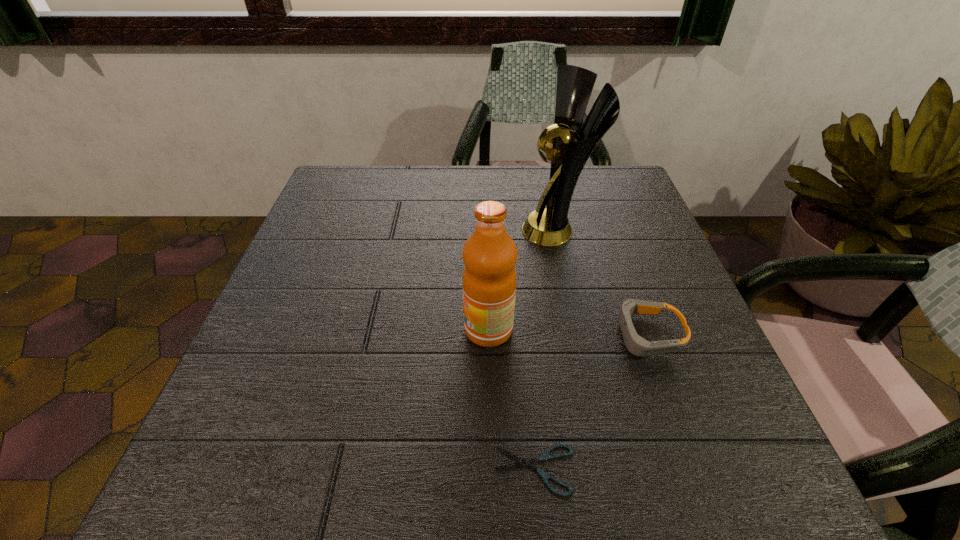
You are a GUI agent. You are given a task and a screenshot of the screen. Output one action in this format:
    pyautogui.click(x=<x>, y=<y>)
    Task: Click on the tallest object
    The image size is (960, 540).
    Given the screenshot: What is the action you would take?
    pyautogui.click(x=550, y=226)

This screenshot has height=540, width=960. In order to click on award in this screenshot , I will do `click(550, 226)`.

The image size is (960, 540). Identify the location of the second tallest object. (489, 280).

What are the coordinates of `goggles` in the screenshot? It's located at (638, 346).

Find the location of `the nearest object`. the nearest object is located at coordinates (545, 476).

At what (x,y) coordinates should I click in order to perform the action: click on the shortest object. Please return your answer as a coordinate pair (x, y). Looking at the image, I should click on (545, 476).

Locate an element on the screen. The width and height of the screenshot is (960, 540). free location located 0.140m at the front of the tallest object, where the globe is visible is located at coordinates (462, 230).

Locate an element on the screen. This screenshot has height=540, width=960. free region located at the front of the tallest object, where the globe is visible is located at coordinates (401, 230).

You are a GUI agent. You are given a task and a screenshot of the screen. Output one action in this format:
    pyautogui.click(x=<x>, y=<y>)
    Task: Click on the vacant space located 0.370m at the front of the tallest object, where the globe is visible
    The height and width of the screenshot is (540, 960).
    Given the screenshot: What is the action you would take?
    pyautogui.click(x=363, y=230)

Find the location of a particular element. The image size is (960, 540). vacant position located 0.210m on the label side of the second tallest object is located at coordinates pyautogui.click(x=349, y=329).